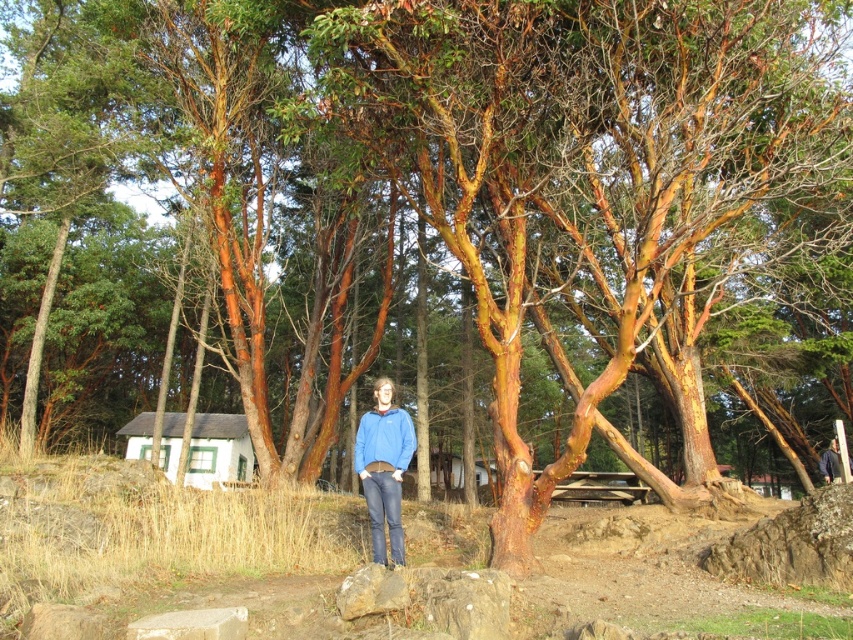
You are a hiker who wants to place a small backpack on the ground near the matte blue sweatshirt at center. Based on the scene, where should you place it so it doesn not get in the way of the smooth gray rock at lower center?

The smooth gray rock at lower center is below the matte blue sweatshirt at center, so you should place the backpack above the smooth gray rock at lower center to avoid blocking it.

You are a photographer trying to capture a closeup of the smooth gray rock at lower center while also including the matte blue sweatshirt at center in the frame. Based on their positions, which object should you adjust your camera angle to focus on first?

The smooth gray rock at lower center is to the right of the matte blue sweatshirt at center, so you should adjust your camera angle to focus on the smooth gray rock at lower center first to include both in the frame.